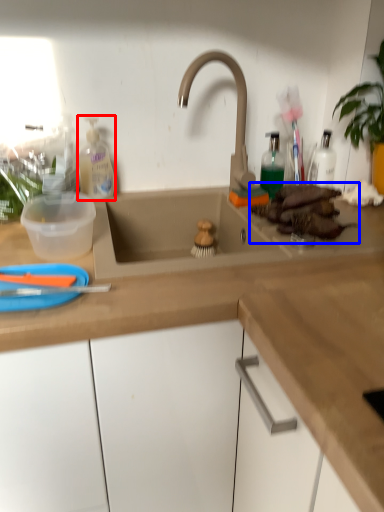
Question: Which of the following is the farthest to the observer, cleaning product (highlighted by a red box) or food (highlighted by a blue box)?

Choices:
 (A) cleaning product
 (B) food

Answer: (A)